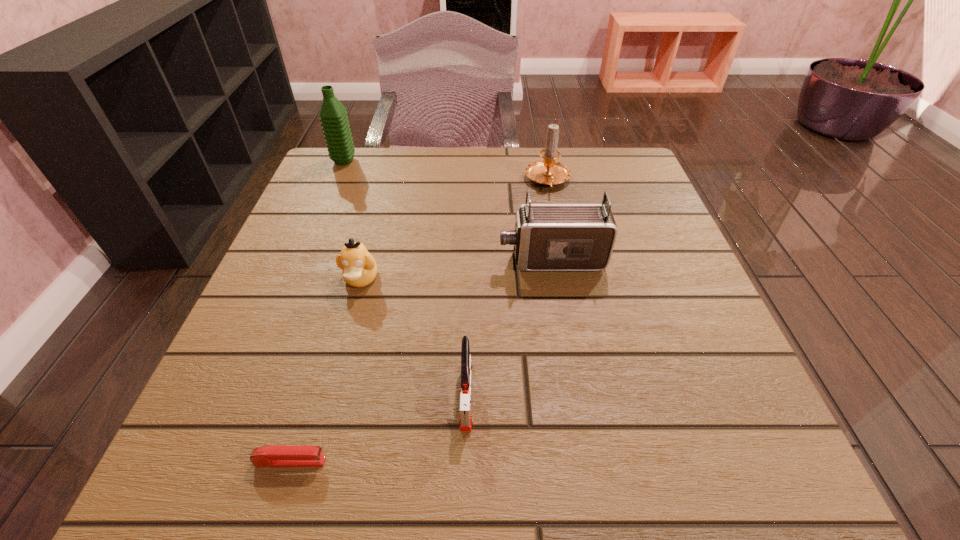
Where is `the tallest object`? The image size is (960, 540). the tallest object is located at coordinates pyautogui.click(x=333, y=116).

The height and width of the screenshot is (540, 960). In order to click on water bottle in this screenshot , I will do `click(333, 116)`.

This screenshot has height=540, width=960. I want to click on camcorder, so [547, 237].

This screenshot has width=960, height=540. I want to click on candle, so click(547, 171).

Locate an element on the screen. duckling is located at coordinates click(x=359, y=268).

The height and width of the screenshot is (540, 960). I want to click on the third object from right to left, so click(x=465, y=416).

Find the location of a particular element. the fifth farthest object is located at coordinates (465, 416).

Where is `the nearest object`? This screenshot has width=960, height=540. the nearest object is located at coordinates point(272,455).

Locate an element on the screen. This screenshot has width=960, height=540. the left stapler is located at coordinates (272, 455).

The height and width of the screenshot is (540, 960). In order to click on vacant space located 0.230m on the front of the leftmost object in this screenshot , I will do click(x=318, y=224).